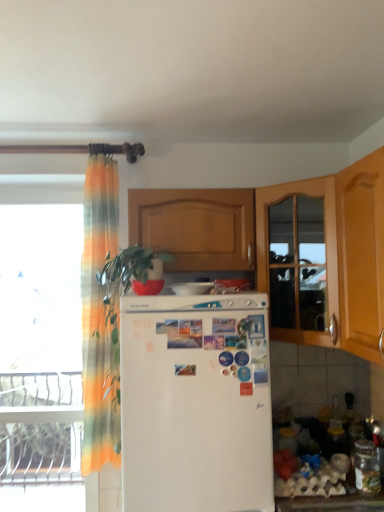
Measure the distance between point (240, 478) and camera.

Point (240, 478) is 1.64 meters from camera.

Describe the element at coordinates (98, 315) in the screenshot. I see `translucent orange-green curtain at left` at that location.

The height and width of the screenshot is (512, 384). What do you see at coordinates (195, 227) in the screenshot?
I see `wooden cabinet at center` at bounding box center [195, 227].

What do you see at coordinates (40, 305) in the screenshot? I see `transparent glass window at left` at bounding box center [40, 305].

The width and height of the screenshot is (384, 512). Find the location of `white glossy refrigerator at center`. white glossy refrigerator at center is located at coordinates (191, 288).

Based on the photo, is white matte refrigerator at center turned away from transparent glass window at left?

No, white matte refrigerator at center's orientation is not away from transparent glass window at left.

Are white matte refrigerator at center and transparent glass window at left located far from each other?

Absolutely, white matte refrigerator at center is distant from transparent glass window at left.

Is point (172, 398) positioned in front of point (38, 352)?

Yes, point (172, 398) is in front of point (38, 352).

Where is `window located above the white matte refrigerator at center (from the image's perspective)`? window located above the white matte refrigerator at center (from the image's perspective) is located at coordinates (40, 305).

How far apart are wooden cabinet at right and white matte refrigerator at center?

The distance of wooden cabinet at right from white matte refrigerator at center is 19.51 inches.

Does wooden cabinet at right have a lesser height compared to white matte refrigerator at center?

Correct, wooden cabinet at right is not as tall as white matte refrigerator at center.

Is wooden cabinet at right with white matte refrigerator at center?

No, wooden cabinet at right is not beside white matte refrigerator at center.

From a real-world perspective, is wooden cabinet at right positioned under white matte refrigerator at center based on gravity?

Incorrect, from a real-world perspective, wooden cabinet at right is higher than white matte refrigerator at center.

Considering the relative positions of wooden cabinet at center and translucent orange-green curtain at left in the image provided, is wooden cabinet at center to the left of translucent orange-green curtain at left from the viewer's perspective?

In fact, wooden cabinet at center is to the right of translucent orange-green curtain at left.

Find the location of a particular element. This screenshot has width=384, height=512. curtain below the wooden cabinet at center (from a real-world perspective) is located at coordinates (98, 315).

How much distance is there between wooden cabinet at center and translucent orange-green curtain at left?

wooden cabinet at center and translucent orange-green curtain at left are 40.30 centimeters apart.

Which of these two, wooden cabinet at center or translucent orange-green curtain at left, is bigger?

wooden cabinet at center is bigger.

Considering the sizes of white glossy refrigerator at center and translucent orange-green curtain at left in the image, is white glossy refrigerator at center taller or shorter than translucent orange-green curtain at left?

white glossy refrigerator at center is shorter than translucent orange-green curtain at left.

The image size is (384, 512). In the image, there is a translucent orange-green curtain at left. What are the coordinates of `appliance above it (from the image's perspective)` in the screenshot? It's located at (191, 288).

From a real-world perspective, which is physically below, white glossy refrigerator at center or translucent orange-green curtain at left?

translucent orange-green curtain at left is physically lower.

Is white glossy refrigerator at center turned away from translucent orange-green curtain at left?

No.

Which object is thinner, wooden cabinet at center or white glossy refrigerator at center?

white glossy refrigerator at center is thinner.

Which of these two, wooden cabinet at center or white glossy refrigerator at center, stands taller?

Standing taller between the two is wooden cabinet at center.

How distant is wooden cabinet at center from white glossy refrigerator at center?

wooden cabinet at center and white glossy refrigerator at center are 12.27 inches apart from each other.

From a real-world perspective, between wooden cabinet at right and white glossy refrigerator at center, who is vertically higher?

wooden cabinet at right, from a real-world perspective.

Based on their sizes in the image, would you say wooden cabinet at right is bigger or smaller than white glossy refrigerator at center?

Clearly, wooden cabinet at right is larger in size than white glossy refrigerator at center.

Is white glossy refrigerator at center surrounded by wooden cabinet at right?

No, white glossy refrigerator at center is not surrounded by wooden cabinet at right.

Considering the positions of objects wooden cabinet at right and white glossy refrigerator at center in the image provided, who is more to the left, wooden cabinet at right or white glossy refrigerator at center?

From the viewer's perspective, white glossy refrigerator at center appears more on the left side.

I want to click on cabinetry above the wooden cabinet at right (from the image's perspective), so click(x=195, y=227).

From the image's perspective, which object appears higher, wooden cabinet at right or wooden cabinet at center?

wooden cabinet at center, from the image's perspective.

Which of these two, wooden cabinet at right or wooden cabinet at center, is thinner?

wooden cabinet at center is thinner.

The image size is (384, 512). I want to click on refrigerator on the right of transparent glass window at left, so click(196, 403).

Find the location of a particular element. refrigerator on the left of the wooden cabinet at right is located at coordinates (196, 403).

From the image, which object appears to be nearer to transparent glass window at left, wooden cabinet at right or white matte refrigerator at center?

The object closer to transparent glass window at left is white matte refrigerator at center.

From the image, which object appears to be nearer to wooden cabinet at center, wooden cabinet at right or white matte refrigerator at center?

wooden cabinet at right lies closer to wooden cabinet at center than the other object.

Which object lies nearer to the anchor point white glossy refrigerator at center, white matte refrigerator at center or transparent glass window at left?

white matte refrigerator at center.

From the image, which object appears to be farther from wooden cabinet at right, wooden cabinet at center or translucent orange-green curtain at left?

The object further to wooden cabinet at right is translucent orange-green curtain at left.

Considering their positions, is transparent glass window at left positioned closer to wooden cabinet at right than white matte refrigerator at center?

white matte refrigerator at center lies closer to wooden cabinet at right than the other object.

When comparing their distances from translucent orange-green curtain at left, does white glossy refrigerator at center or white matte refrigerator at center seem closer?

Based on the image, white matte refrigerator at center appears to be nearer to translucent orange-green curtain at left.

When comparing their distances from white glossy refrigerator at center, does wooden cabinet at right or white matte refrigerator at center seem closer?

white matte refrigerator at center is positioned closer to the anchor white glossy refrigerator at center.

Looking at the image, which one is located further to white glossy refrigerator at center, translucent orange-green curtain at left or wooden cabinet at center?

translucent orange-green curtain at left lies further to white glossy refrigerator at center than the other object.

You are a GUI agent. You are given a task and a screenshot of the screen. Output one action in this format:
    pyautogui.click(x=<x>, y=<y>)
    Task: Click on the cabinetry situated between white glossy refrigerator at center and wooden cabinet at right from left to right
    Image resolution: width=384 pixels, height=512 pixels.
    Given the screenshot: What is the action you would take?
    pyautogui.click(x=195, y=227)

The height and width of the screenshot is (512, 384). Identify the location of appliance between translucent orange-green curtain at left and wooden cabinet at center. (191, 288).

Where is `cabinetry between transparent glass window at left and wooden cabinet at right from left to right`? The image size is (384, 512). cabinetry between transparent glass window at left and wooden cabinet at right from left to right is located at coordinates (195, 227).

This screenshot has height=512, width=384. I want to click on cabinetry situated between translucent orange-green curtain at left and wooden cabinet at right from left to right, so click(195, 227).